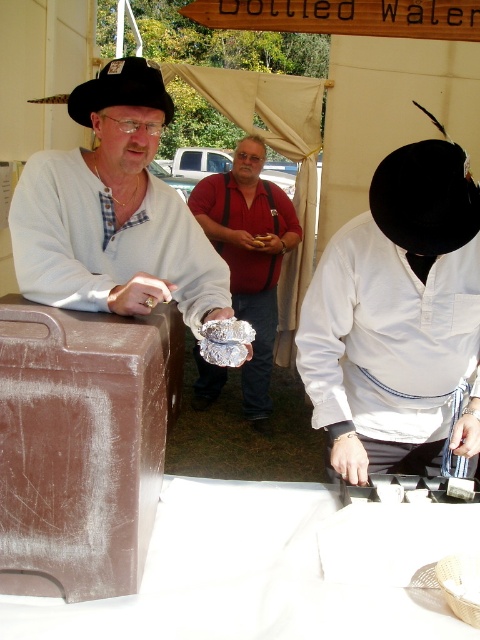
You are a photographer at the event and want to capture both the matte white shirt at left and the matte red shirt at center in a single shot. Which subject should you focus on first to ensure both are in frame?

You should focus on the matte white shirt at left first because it is closer to the camera than the matte red shirt at center, ensuring both will be in the frame when positioned correctly.

Based on the scene description, where is the white satin shirt at center located in relation to the other elements?

The white satin shirt at center is located at point (x=387, y=340).